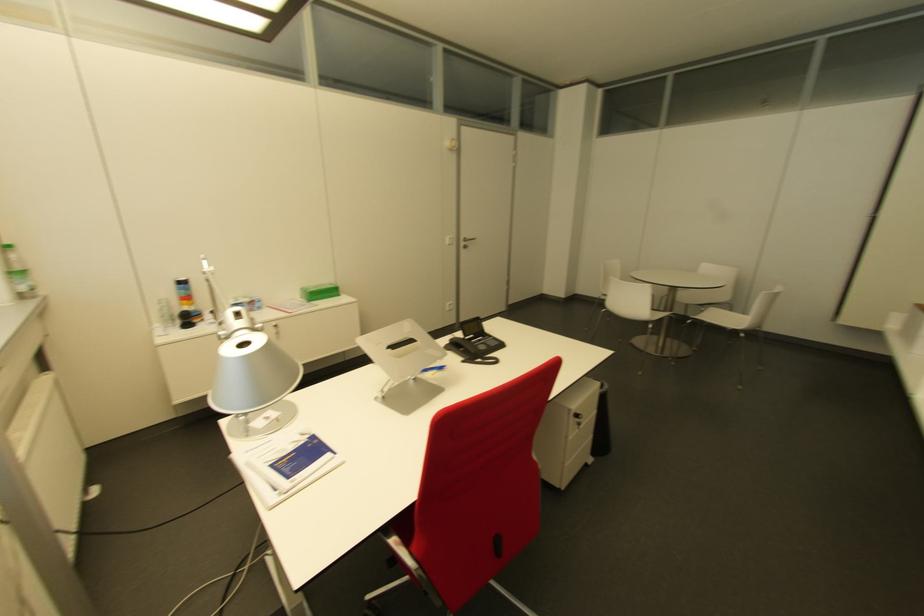
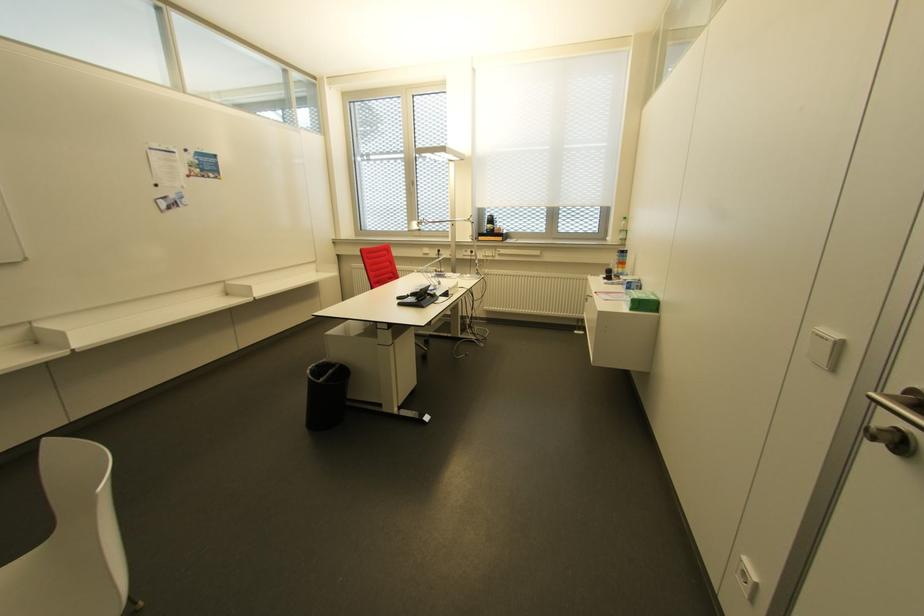
The point at (x=448, y=237) is marked in the first image. Where is the corresponding point in the second image?

(833, 334)